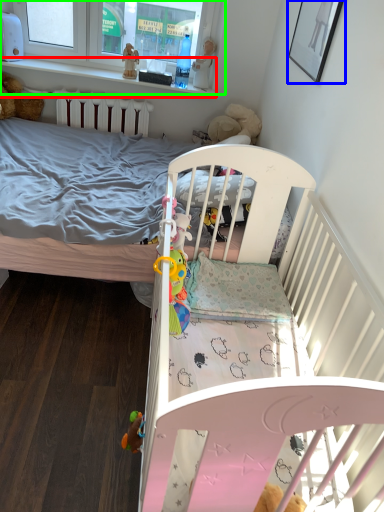
Question: Which object is the farthest from balustrade (highlighted by a red box)? Choose among these: picture frame (highlighted by a blue box) or window frame (highlighted by a green box).

Choices:
 (A) picture frame
 (B) window frame

Answer: (A)